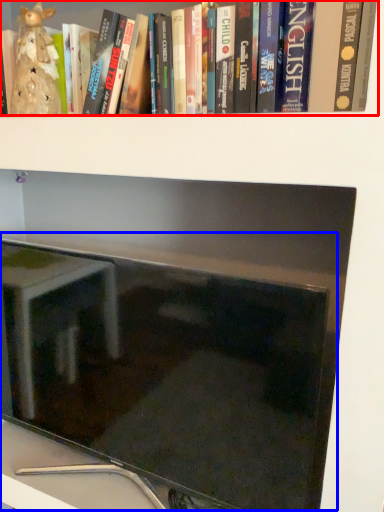
Question: Among these objects, which one is farthest to the camera, book (highlighted by a red box) or computer monitor (highlighted by a blue box)?

Choices:
 (A) book
 (B) computer monitor

Answer: (B)